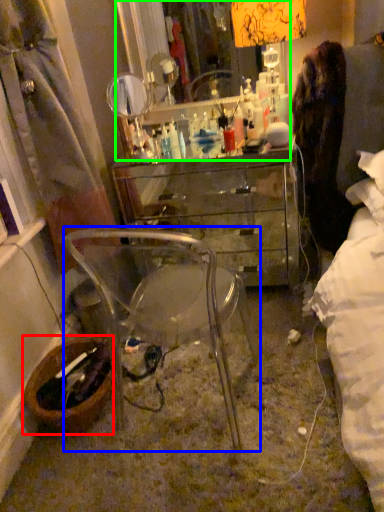
Question: Which object is positioned farthest from picnic basket (highlighted by a red box)? Select from chair (highlighted by a blue box) and mirror (highlighted by a green box).

Choices:
 (A) chair
 (B) mirror

Answer: (B)